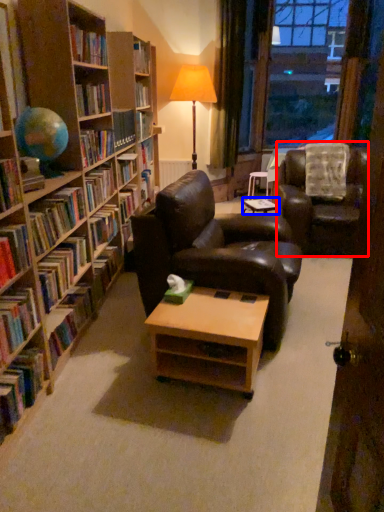
Question: Which object appears farthest to the camera in this image, chair (highlighted by a red box) or table (highlighted by a blue box)?

Choices:
 (A) chair
 (B) table

Answer: (B)